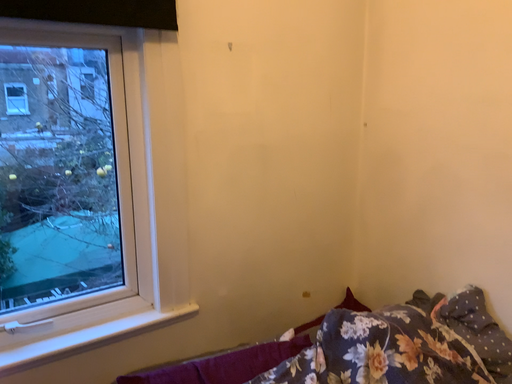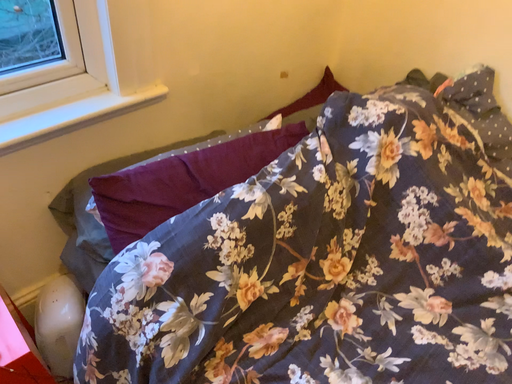
Question: How did the camera likely rotate when shooting the video?

Choices:
 (A) rotated left
 (B) rotated right

Answer: (B)